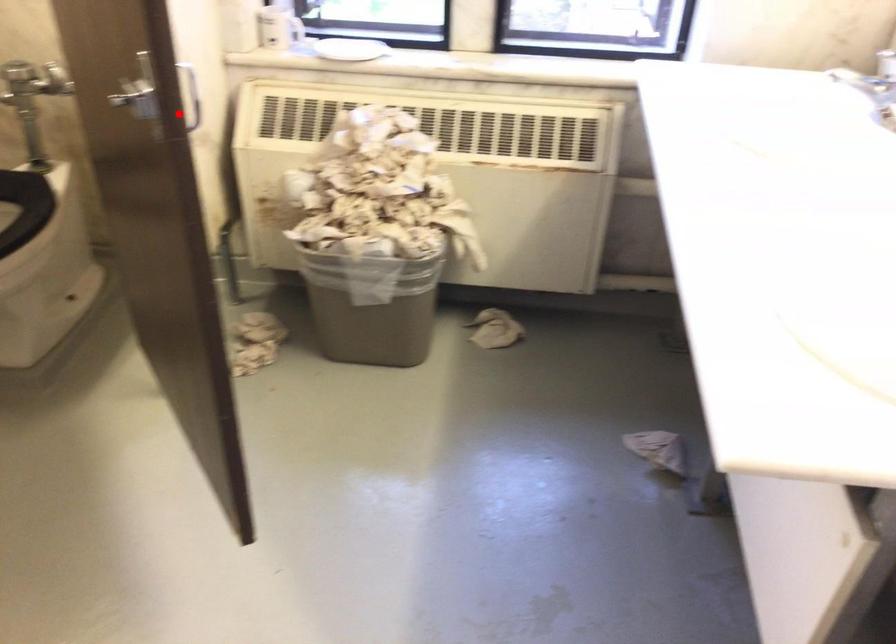
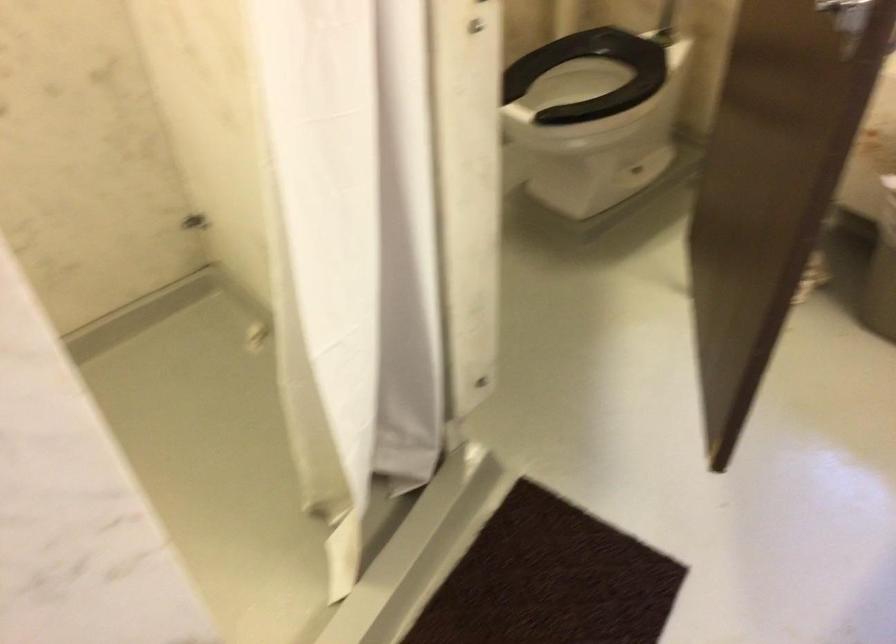
Question: I am providing you with two images of the same scene from different viewpoints. In image1, a red point is highlighted. Considering the same 3D point in image2, which of the following is correct?

Choices:
 (A) It is closer
 (B) It is farther

Answer: (A)